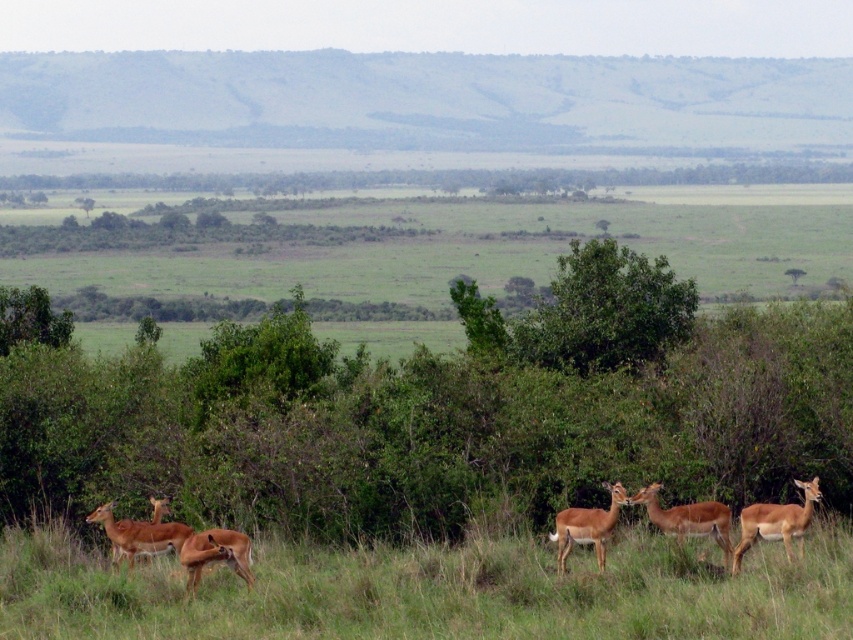
Who is higher up, brown glossy antelope at center or brown velvet antelope at lower left?

brown glossy antelope at center is above.

What are the coordinates of `brown glossy antelope at center` in the screenshot? It's located at (688, 518).

The image size is (853, 640). I want to click on brown glossy antelope at center, so click(688, 518).

Which is below, green leafy bush at upper left or brown matte antelope at center?

brown matte antelope at center is lower down.

Which is more to the left, green leafy bush at upper left or brown matte antelope at center?

From the viewer's perspective, green leafy bush at upper left appears more on the left side.

Who is more distant from viewer, (x=27, y=337) or (x=590, y=538)?

The point (x=27, y=337) is more distant.

The width and height of the screenshot is (853, 640). Find the location of `green leafy bush at upper left`. green leafy bush at upper left is located at coordinates (30, 317).

Between green leafy tree at center and green leafy bush at upper left, which one appears on the right side from the viewer's perspective?

green leafy tree at center

Which is below, green leafy tree at center or green leafy bush at upper left?

green leafy tree at center is below.

Is point (599, 365) more distant than point (16, 308)?

No, it is not.

Image resolution: width=853 pixels, height=640 pixels. In order to click on green leafy tree at center in this screenshot , I will do `click(605, 310)`.